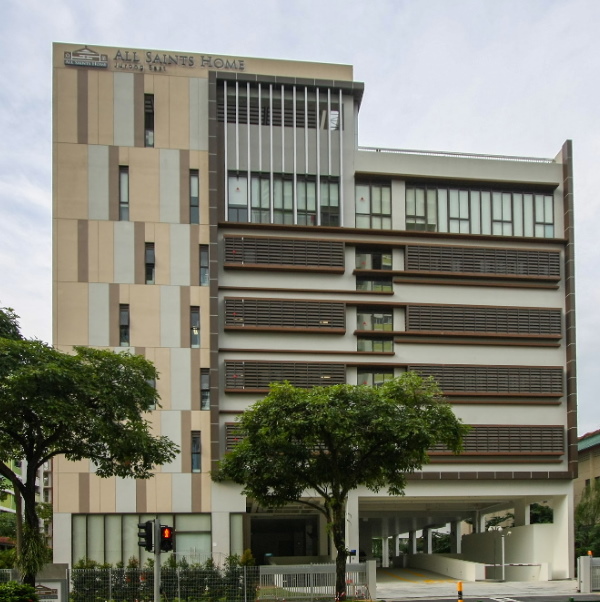
I want to click on hotel, so click(x=419, y=170).